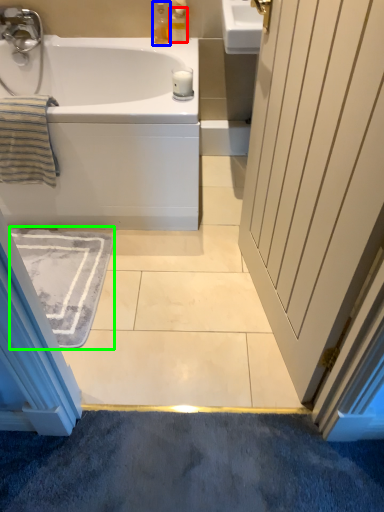
Question: Based on their relative distances, which object is nearer to toiletry (highlighted by a red box)? Choose from soap dispenser (highlighted by a blue box) and bath mat (highlighted by a green box).

Choices:
 (A) soap dispenser
 (B) bath mat

Answer: (A)